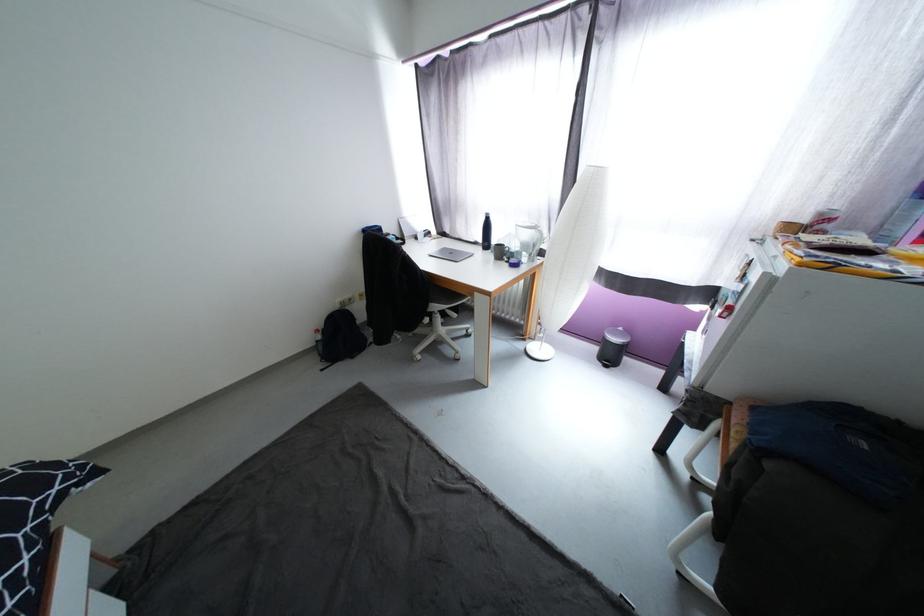
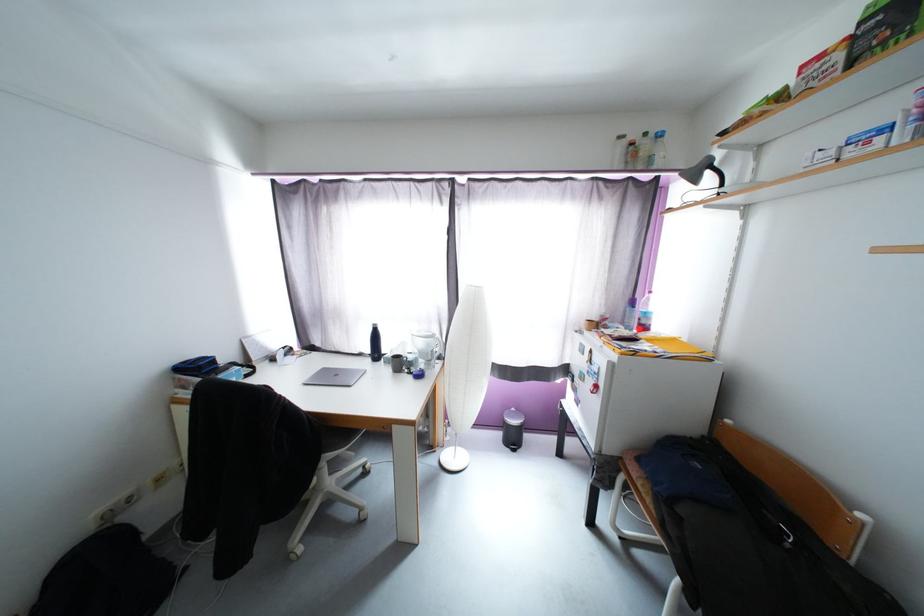
The point at (528,350) is marked in the first image. Where is the corresponding point in the second image?

(442, 464)